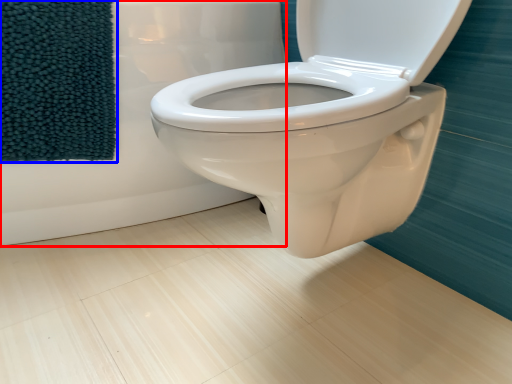
Question: Which object is closer to the camera taking this photo, bath (highlighted by a red box) or beach towel (highlighted by a blue box)?

Choices:
 (A) bath
 (B) beach towel

Answer: (A)